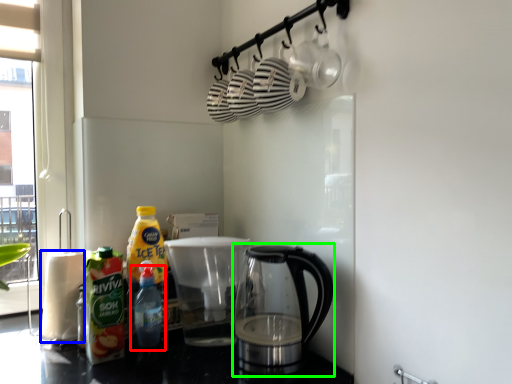
Question: Based on their relative distances, which object is nearer to bottle (highlighted by a red box)? Choose from paper towel (highlighted by a blue box) and kettle (highlighted by a green box).

Choices:
 (A) paper towel
 (B) kettle

Answer: (A)